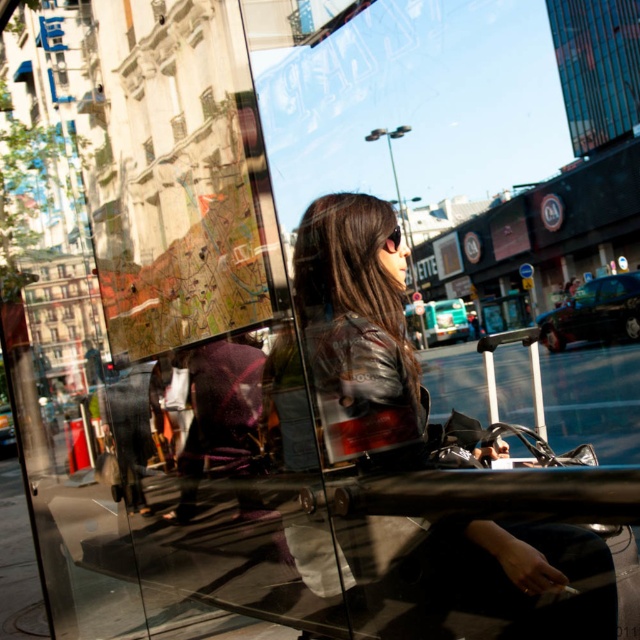
Looking at this image, can you confirm if leather jacket at center is positioned to the left of black plastic sunglasses at center?

No, leather jacket at center is not to the left of black plastic sunglasses at center.

Is point (320, 266) closer to viewer compared to point (384, 246)?

Yes, point (320, 266) is closer to viewer.

The image size is (640, 640). What are the coordinates of `leather jacket at center` in the screenshot? It's located at (358, 336).